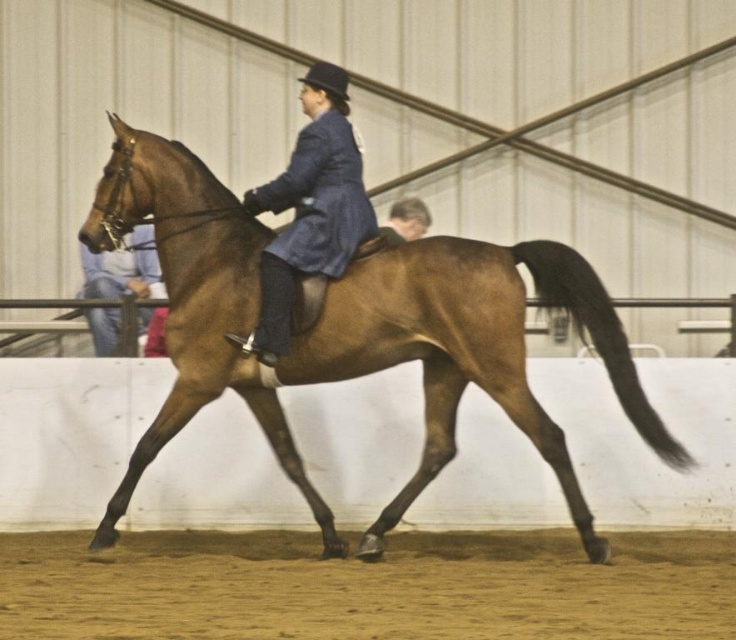
Question: In this image, where is brown glossy horse at center located relative to blue woolen coat at center?

Choices:
 (A) left
 (B) right

Answer: (B)

Question: Which point is closer to the camera?

Choices:
 (A) brown glossy horse at center
 (B) blue woolen coat at center

Answer: (A)

Question: Which point is farther to the camera?

Choices:
 (A) (236, 298)
 (B) (311, 227)

Answer: (B)

Question: Among these points, which one is nearest to the camera?

Choices:
 (A) (300, 218)
 (B) (509, 272)

Answer: (B)

Question: Does brown glossy horse at center appear over blue woolen coat at center?

Choices:
 (A) yes
 (B) no

Answer: (B)

Question: Is brown glossy horse at center below blue woolen coat at center?

Choices:
 (A) yes
 (B) no

Answer: (A)